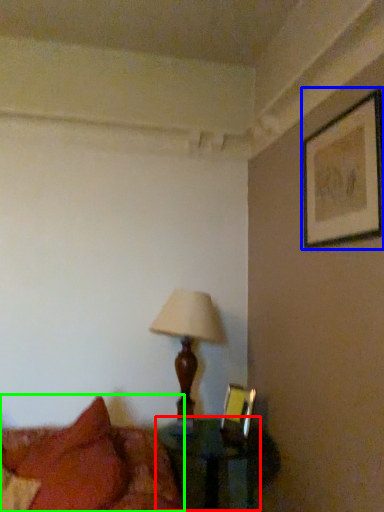
Question: Which object is the farthest from table (highlighted by a red box)? Choose among these: picture frame (highlighted by a blue box) or bed (highlighted by a green box).

Choices:
 (A) picture frame
 (B) bed

Answer: (A)